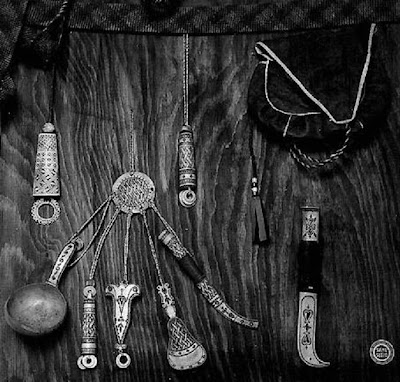
Identify the location of cord. The height and width of the screenshot is (382, 400). (51, 94).